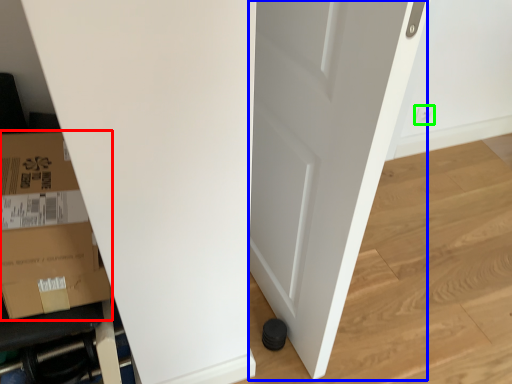
Question: Which object is positioned farthest from cardboard box (highlighted by a red box)? Select from door (highlighted by a blue box) and electric outlet (highlighted by a green box).

Choices:
 (A) door
 (B) electric outlet

Answer: (B)